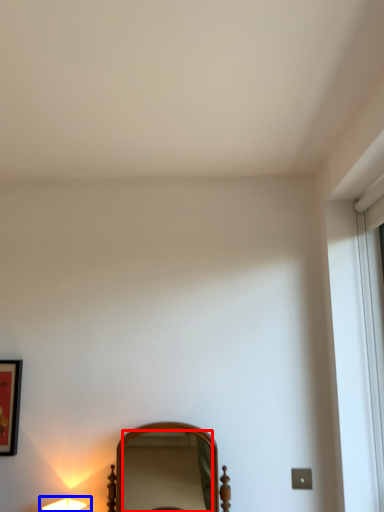
Question: Among these objects, which one is farthest to the camera, mirror (highlighted by a red box) or lamp (highlighted by a blue box)?

Choices:
 (A) mirror
 (B) lamp

Answer: (B)